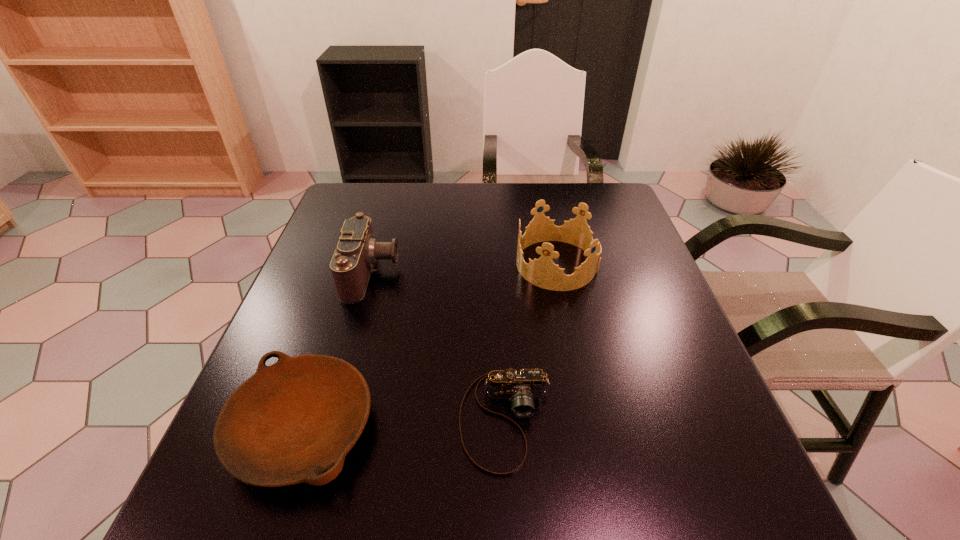
Where is `vacant space at the left edge of the desktop`? The image size is (960, 540). vacant space at the left edge of the desktop is located at coordinates (277, 327).

Image resolution: width=960 pixels, height=540 pixels. In the image, there is a desktop. Identify the location of vacant space at the right edge. (669, 376).

This screenshot has height=540, width=960. I want to click on blank space at the far left corner of the desktop, so click(367, 197).

Where is `vacant area between the right camera and the tiara`? vacant area between the right camera and the tiara is located at coordinates (531, 342).

The height and width of the screenshot is (540, 960). I want to click on unoccupied area between the plate and the right camera, so click(x=404, y=424).

Where is `free spot between the farther camera and the tiara`? This screenshot has width=960, height=540. free spot between the farther camera and the tiara is located at coordinates (465, 268).

Locate an element on the screen. The height and width of the screenshot is (540, 960). vacant area between the tiara and the right camera is located at coordinates (531, 342).

At what (x,y) coordinates should I click in order to perform the action: click on free spot between the nearer camera and the tiara. Please return your answer as a coordinate pair (x, y). Looking at the image, I should click on (531, 342).

Locate an element on the screen. Image resolution: width=960 pixels, height=540 pixels. unoccupied area between the shorter camera and the left camera is located at coordinates (439, 346).

Image resolution: width=960 pixels, height=540 pixels. In order to click on vacant point located between the shorter camera and the plate in this screenshot , I will do `click(404, 424)`.